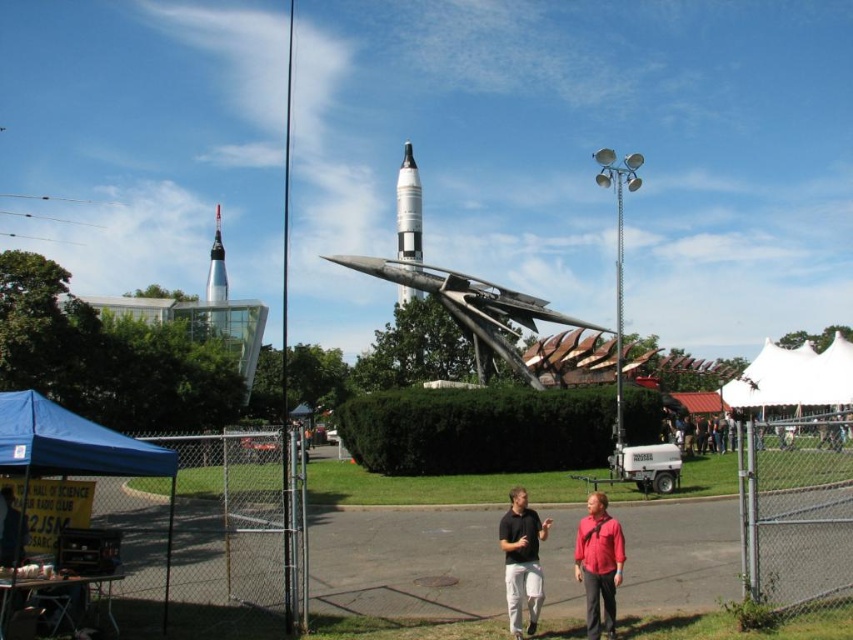
Question: Is silver chain-link fence at lower right bigger than matte black shirt at center?

Choices:
 (A) no
 (B) yes

Answer: (B)

Question: Is matte red shirt at center positioned behind matte black shirt at center?

Choices:
 (A) no
 (B) yes

Answer: (A)

Question: Which is nearer to the silver chain-link fence at lower right?

Choices:
 (A) silver chain-link fence at left
 (B) white canvas canopy at upper right
 (C) matte black shirt at center

Answer: (C)

Question: Among these objects, which one is nearest to the camera?

Choices:
 (A) white canvas canopy at upper right
 (B) matte black shirt at center
 (C) silver chain-link fence at lower right
 (D) matte red shirt at center

Answer: (D)

Question: Does shiny silver rocket at center appear over shiny silver rocket at upper left?

Choices:
 (A) no
 (B) yes

Answer: (B)

Question: Which object is positioned closest to the blue fabric canopy at lower left?

Choices:
 (A) silver chain-link fence at lower right
 (B) shiny silver rocket at center
 (C) shiny silver rocket at upper left
 (D) blue fabric tent at lower left

Answer: (D)